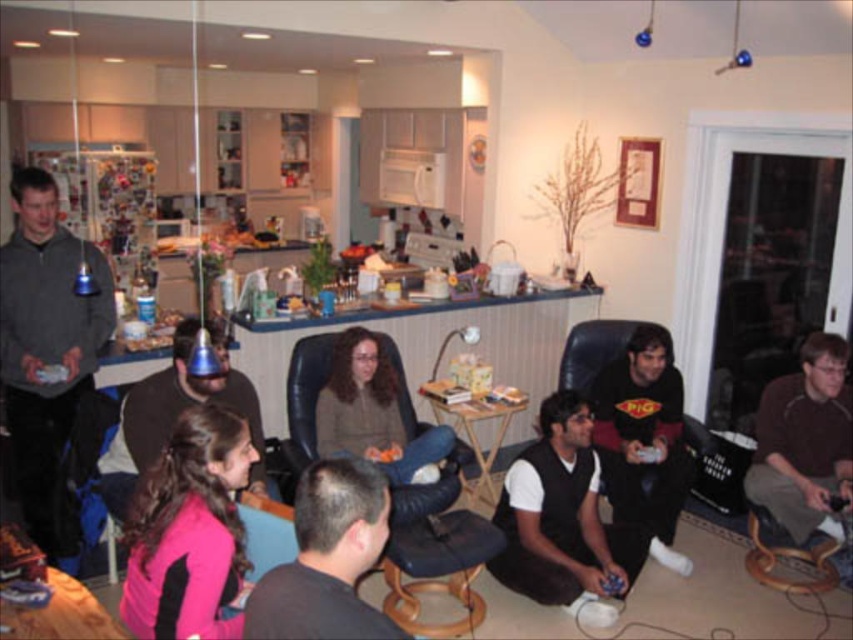
Which is behind, point (22, 465) or point (352, 612)?

Point (22, 465)

Between point (77, 356) and point (352, 636), which one is positioned in front?

Positioned in front is point (352, 636).

In order to click on gray matte jacket at left in this screenshot , I will do `click(45, 342)`.

Which of these two, black leather armchair at center or pink fabric shirt at center, stands shorter?

Standing shorter between the two is pink fabric shirt at center.

Identify the location of black leather armchair at center. The image size is (853, 640). (368, 419).

Does black leather armchair at center have a smaller size compared to black matte shirt at lower right?

No, black leather armchair at center is not smaller than black matte shirt at lower right.

Who is positioned more to the right, black leather armchair at center or black matte shirt at lower right?

black matte shirt at lower right

You are a GUI agent. You are given a task and a screenshot of the screen. Output one action in this format:
    pyautogui.click(x=<x>, y=<y>)
    Task: Click on the black leather armchair at center
    Image resolution: width=853 pixels, height=640 pixels.
    Given the screenshot: What is the action you would take?
    pyautogui.click(x=368, y=419)